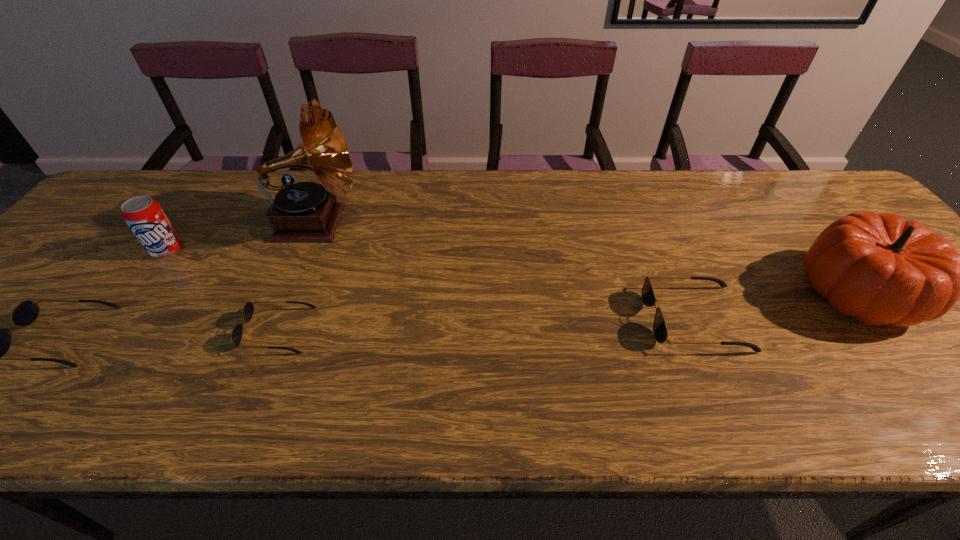
The width and height of the screenshot is (960, 540). I want to click on vacant position for inserting another sunglasses evenly, so click(489, 324).